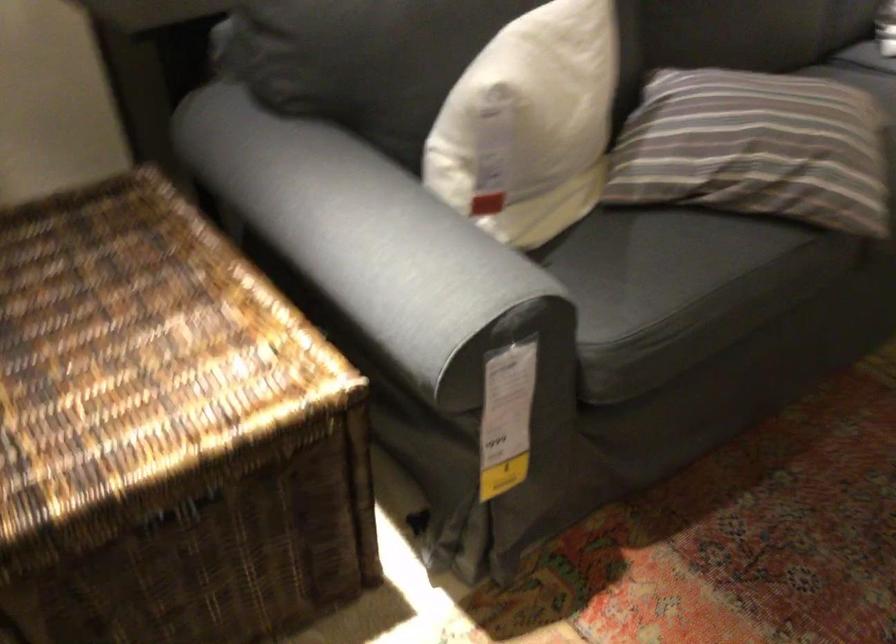
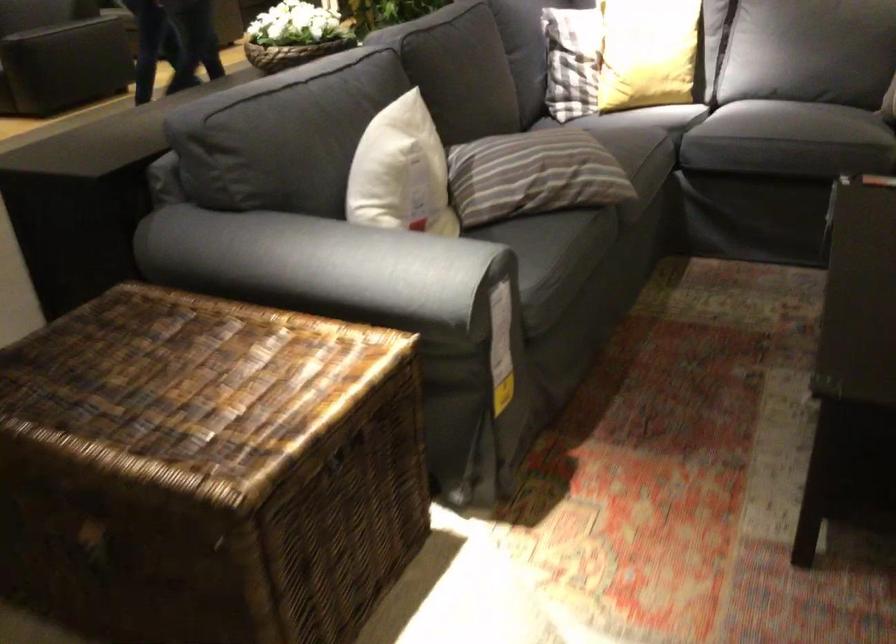
Locate, in the second image, the point that corresponds to the point at 728,154 in the first image.

(533, 174)